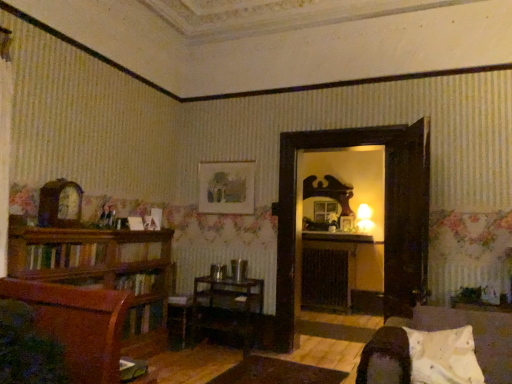
I want to click on vacant area situated below wooden table at center (from a real-world perspective), so click(221, 349).